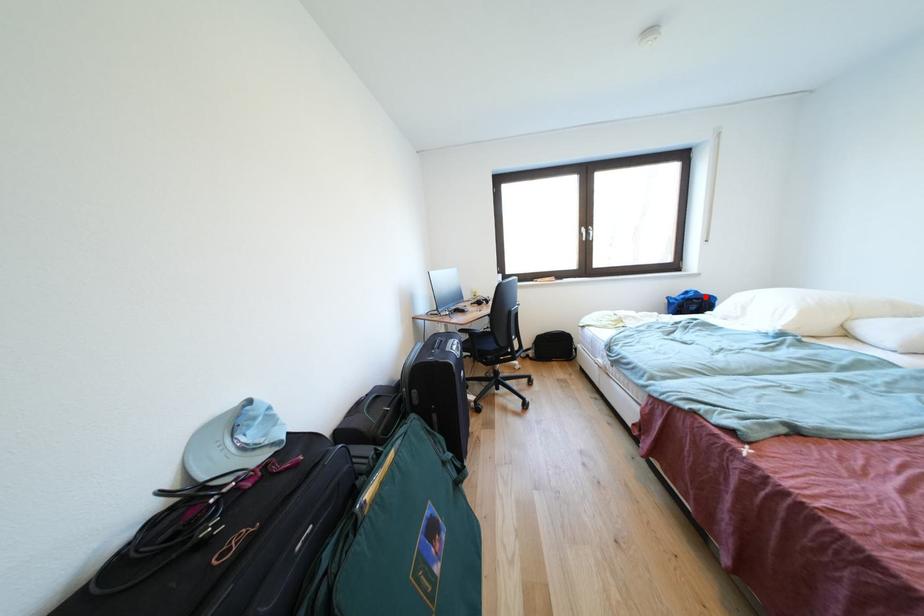
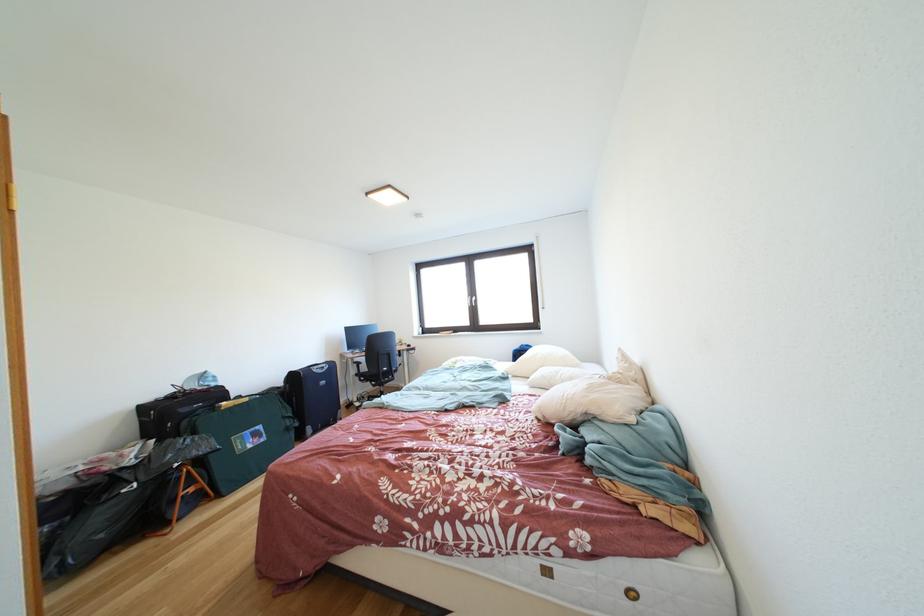
The point at the highlighted location is marked in the first image. Where is the corresponding point in the second image?

(535, 351)